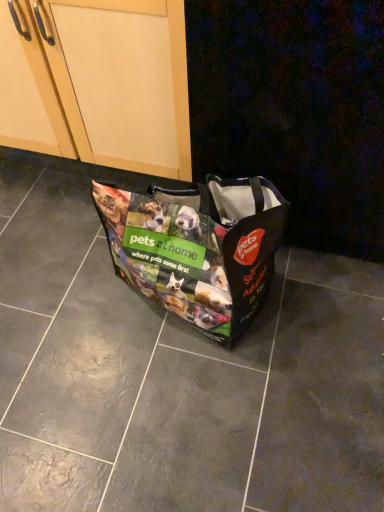
Image resolution: width=384 pixels, height=512 pixels. Describe the element at coordinates (197, 249) in the screenshot. I see `polyester tote bag at center` at that location.

The height and width of the screenshot is (512, 384). Identify the location of polyester tote bag at center. (197, 249).

Where is `polyester tote bag at center`? This screenshot has height=512, width=384. polyester tote bag at center is located at coordinates (197, 249).